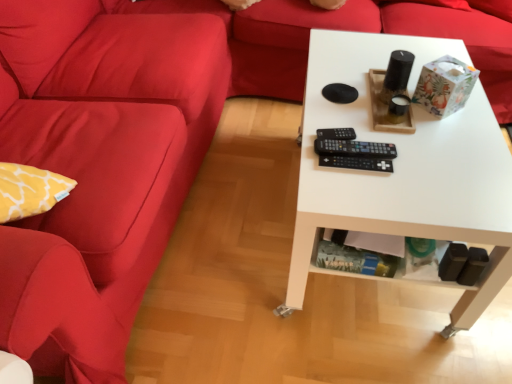
You are a GUI agent. You are given a task and a screenshot of the screen. Output one action in this format:
    pyautogui.click(x=<x>, y=<y>)
    Task: Click on the vacant position to the left of black plastic remote at center, arranged as the second control when viewed from the top
    This screenshot has width=512, height=384.
    Given the screenshot: What is the action you would take?
    pyautogui.click(x=317, y=150)